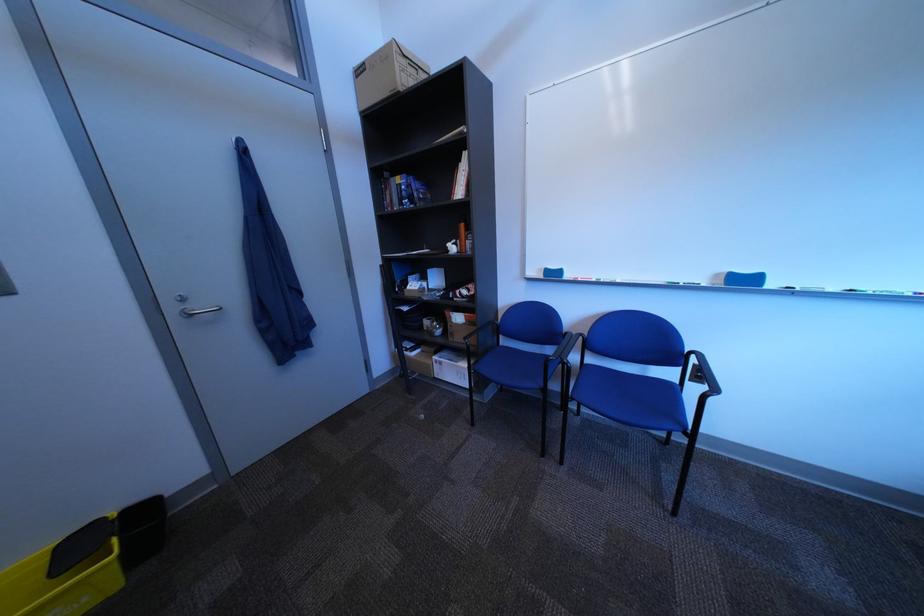
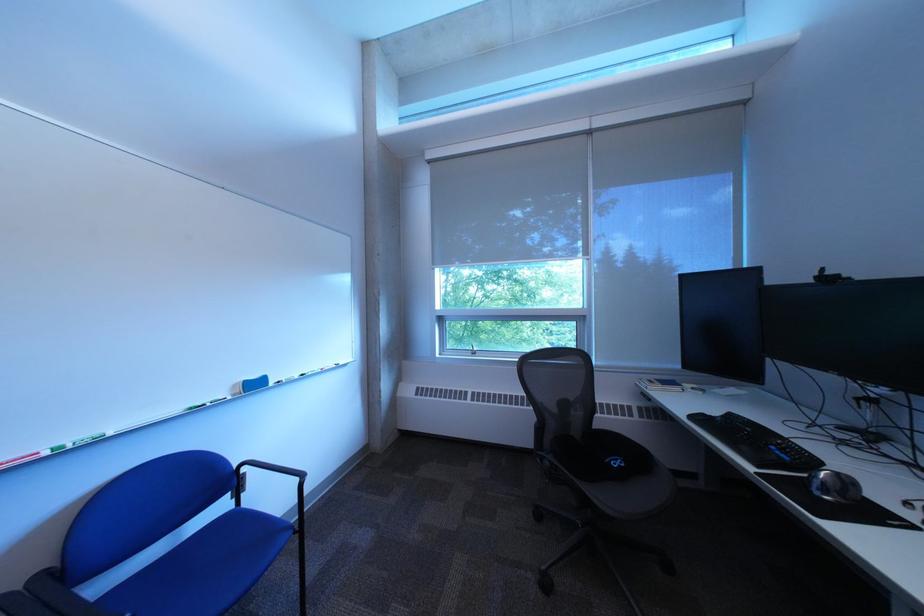
Question: The first image is from the beginning of the video and the second image is from the end. How did the camera likely rotate when shooting the video?

Choices:
 (A) Left
 (B) Right
 (C) Up
 (D) Down

Answer: (B)